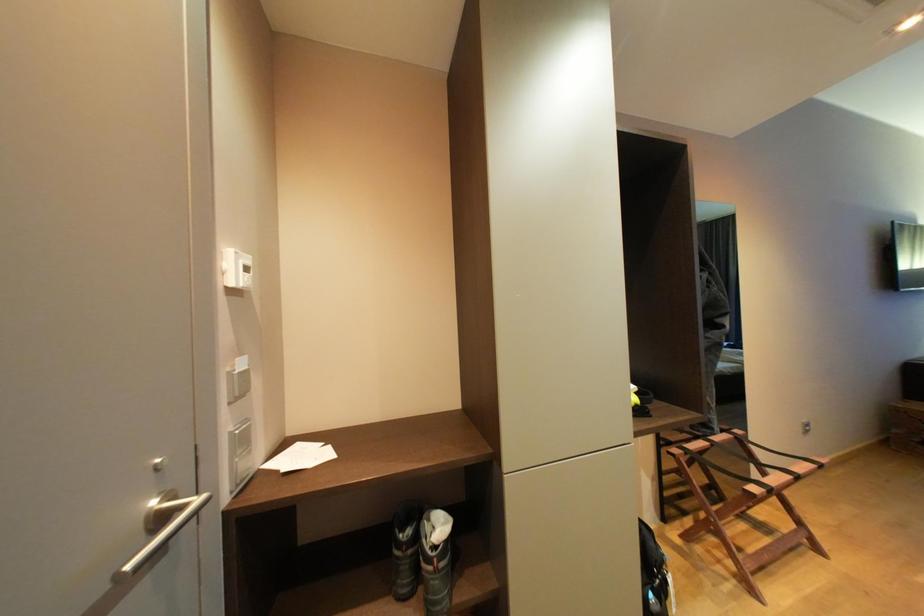
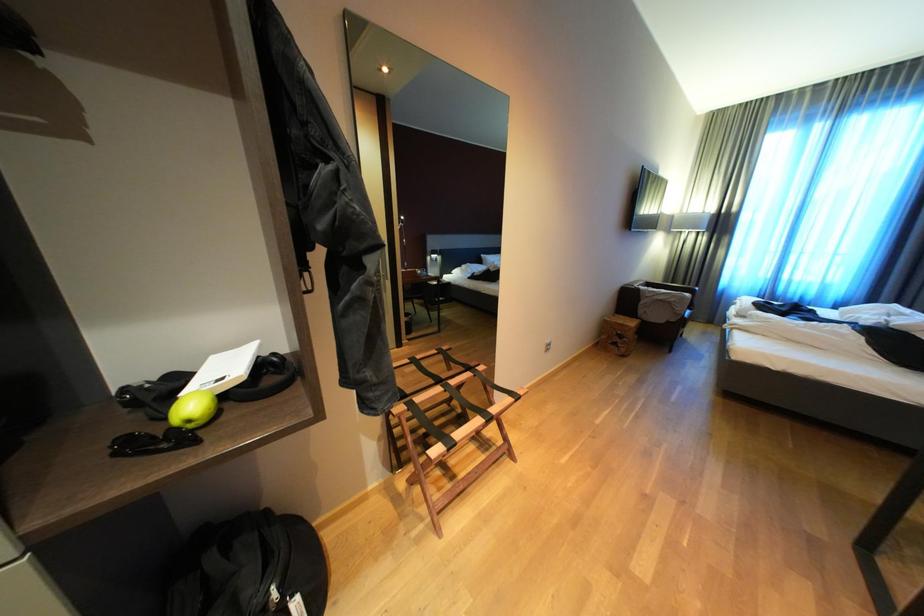
What movement of the cameraman would produce the second image?

The cameraman walked toward right, forward.